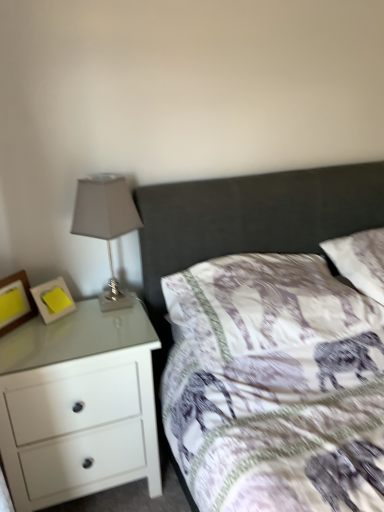
Find the location of a particular element. This screenshot has height=512, width=384. free space above white glossy chest of drawers at left (from a real-world perspective) is located at coordinates (61, 328).